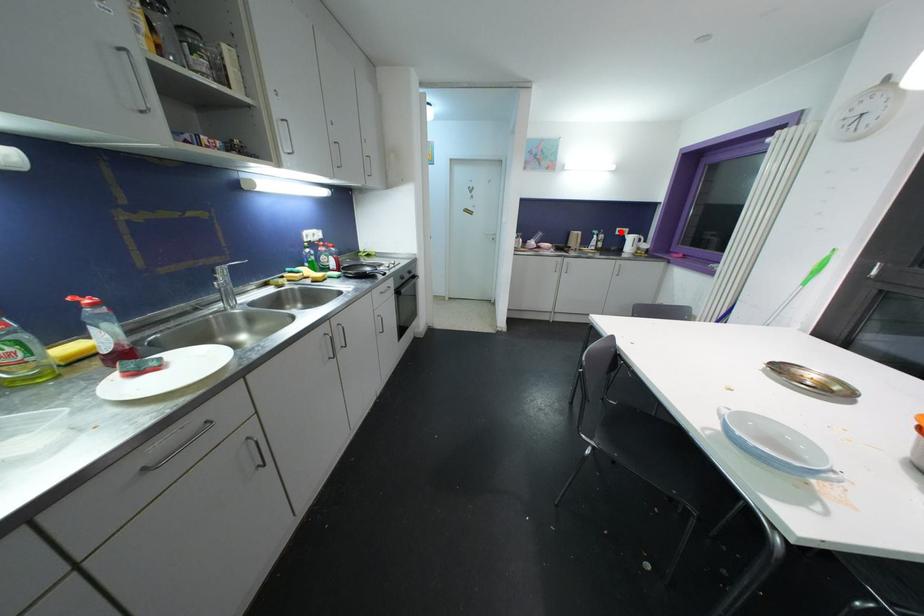
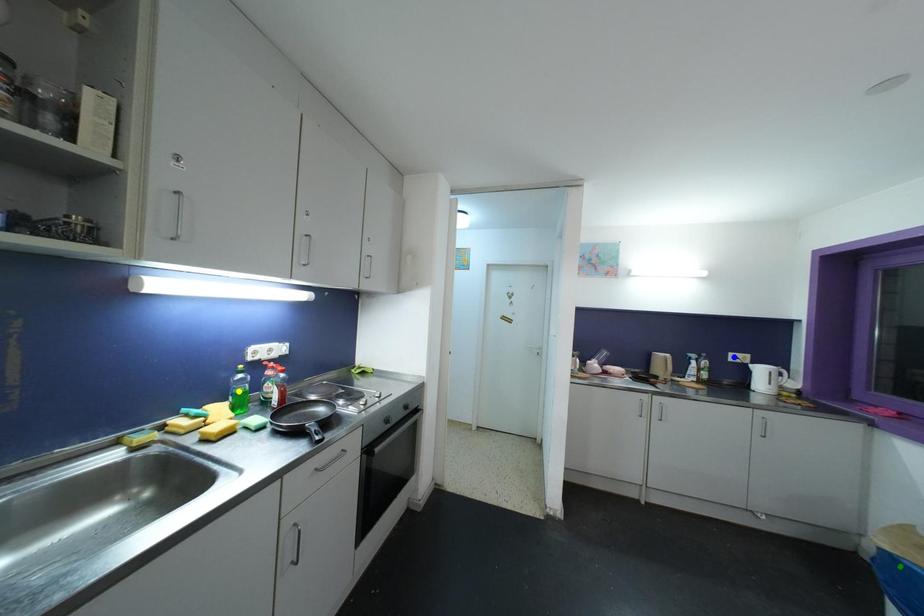
Question: I am providing you with two images of the same scene from different viewpoints. A red point is marked on the first image. You are given multiple points on the second image. Can you choose the point in image 2 that corresponds to the point in image 1?

Choices:
 (A) yellow point
 (B) blue point
 (C) green point

Answer: (B)